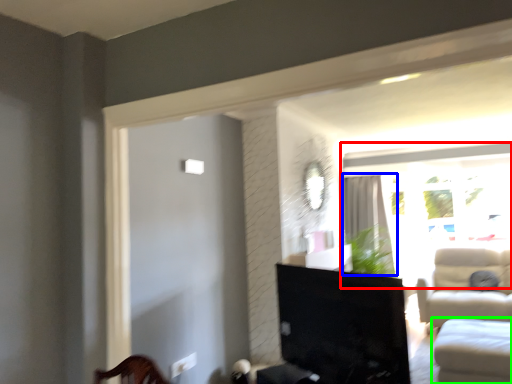
Question: Estimate the real-world distances between objects in this image. Which object is closer to window (highlighted by a red box), curtain (highlighted by a blue box) or studio couch (highlighted by a green box)?

Choices:
 (A) curtain
 (B) studio couch

Answer: (A)